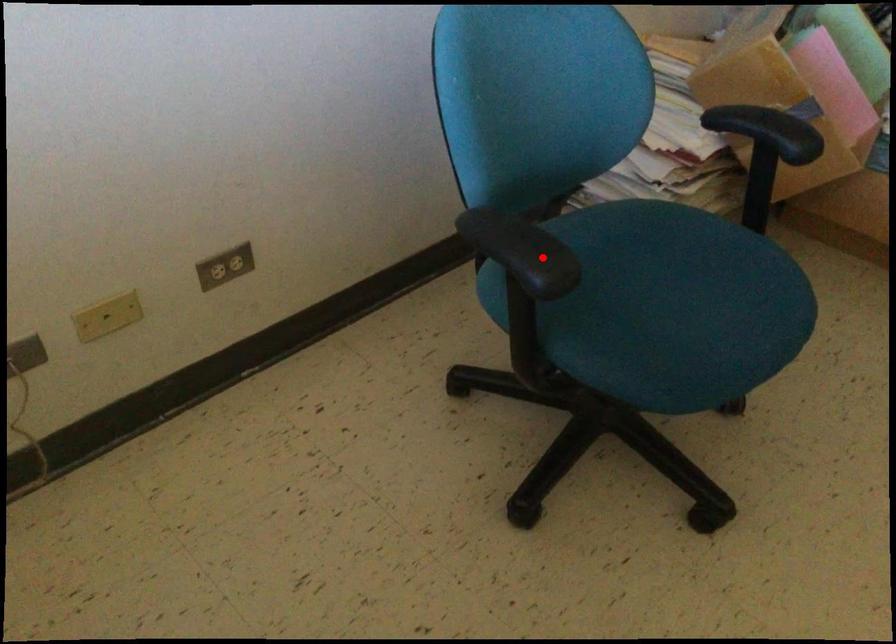
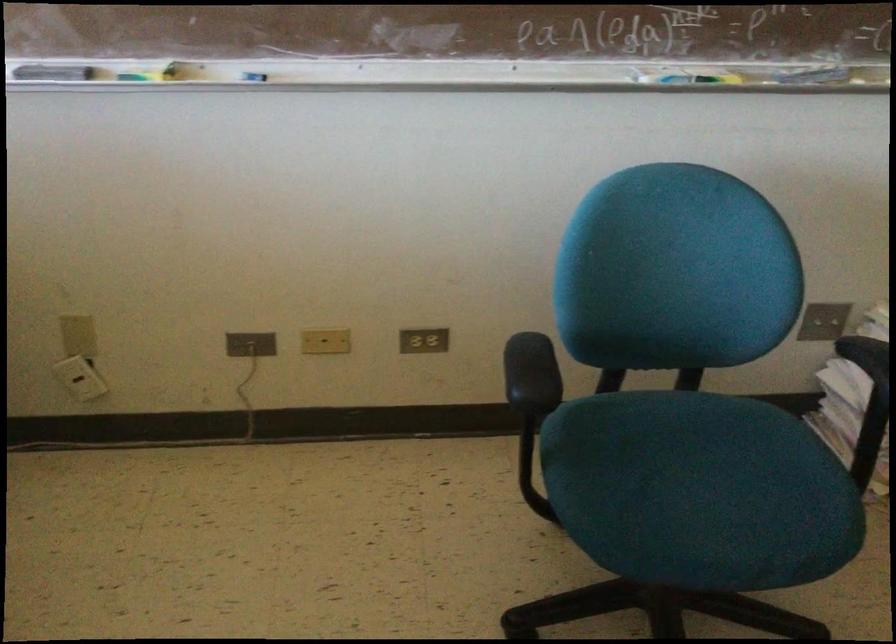
Find the pixel in the second image that matches the highlighted location in the first image.

(531, 374)